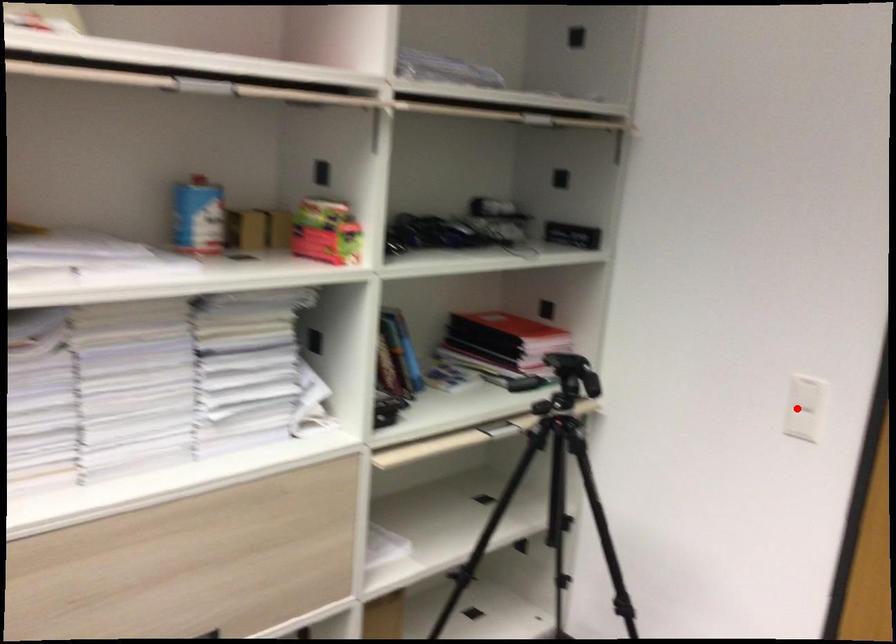
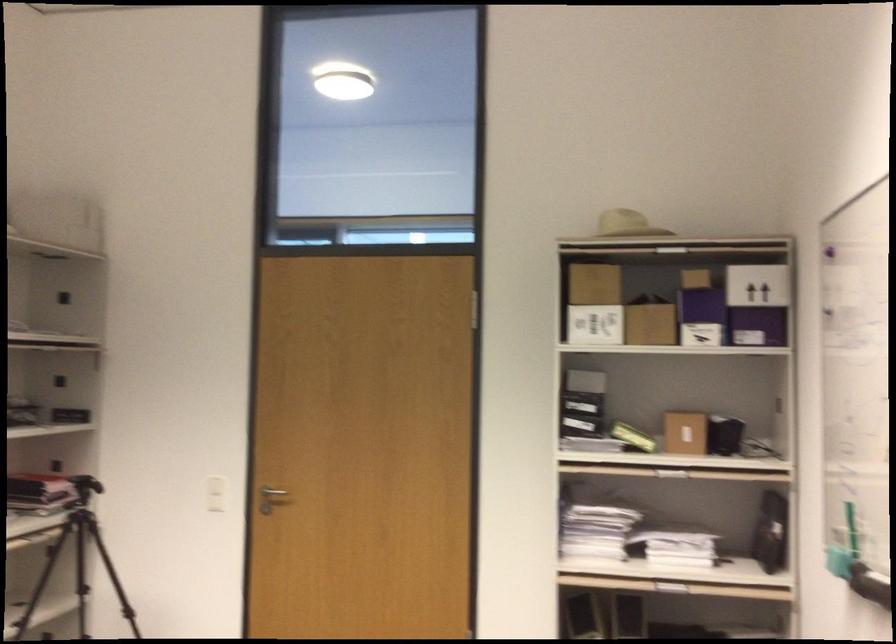
Question: I am providing you with two images of the same scene from different viewpoints. In image1, a red point is highlighted. Considering the same 3D point in image2, which of the following is correct?

Choices:
 (A) It is closer
 (B) It is farther

Answer: (B)